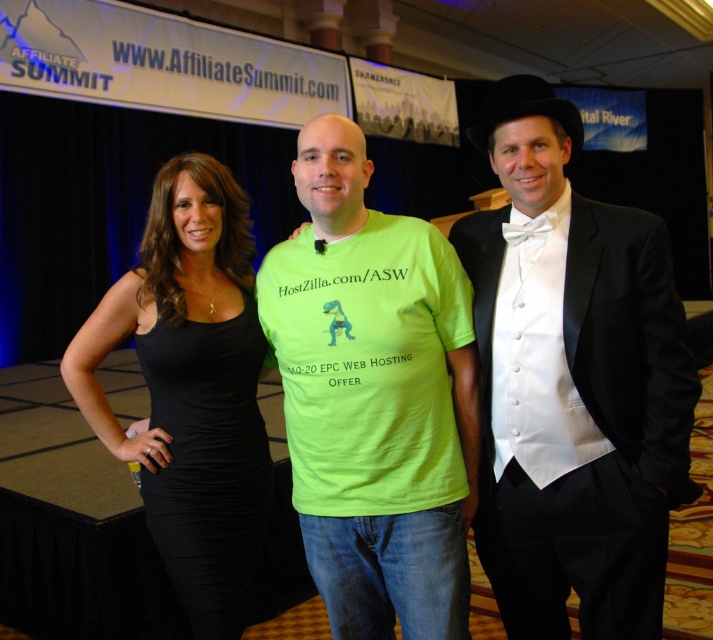
Question: Which object is the farthest from the black satin dress at left?

Choices:
 (A) neon green t-shirt at center
 (B) black satin suit at right
 (C) black dress at left
 (D) white satin vest at center

Answer: (B)

Question: Which point appears closest to the camera in this image?

Choices:
 (A) (202, 396)
 (B) (165, 225)
 (C) (530, 284)

Answer: (C)

Question: Does black satin suit at right have a greater width compared to white satin vest at center?

Choices:
 (A) no
 (B) yes

Answer: (B)

Question: Observing the image, what is the correct spatial positioning of neon green t-shirt at center in reference to white satin vest at center?

Choices:
 (A) left
 (B) right

Answer: (A)

Question: Which object is positioned closest to the black satin suit at right?

Choices:
 (A) black dress at left
 (B) black satin dress at left
 (C) white satin vest at center

Answer: (C)

Question: Is neon green t-shirt at center smaller than white satin vest at center?

Choices:
 (A) no
 (B) yes

Answer: (A)